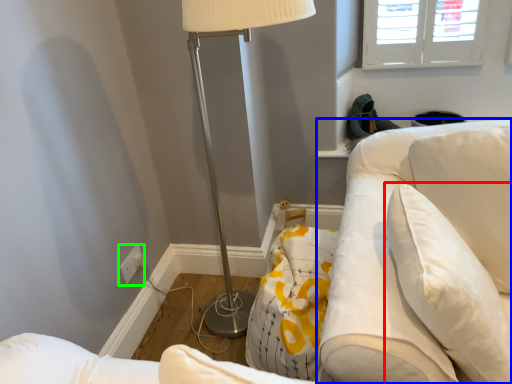
Question: Based on their relative distances, which object is nearer to pillow (highlighted by a red box)? Choose from swivel chair (highlighted by a blue box) and electric outlet (highlighted by a green box).

Choices:
 (A) swivel chair
 (B) electric outlet

Answer: (A)